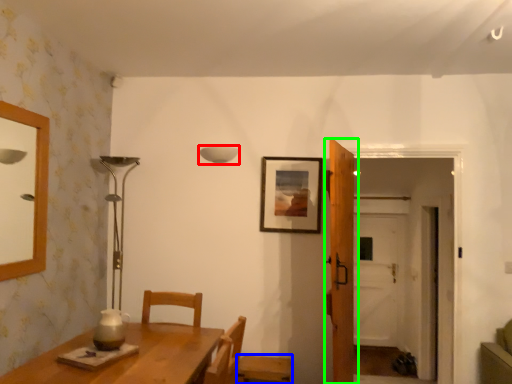
Question: Which object is positioned farthest from lamp (highlighted by a red box)? Select from chair (highlighted by a blue box) and door (highlighted by a green box).

Choices:
 (A) chair
 (B) door

Answer: (A)